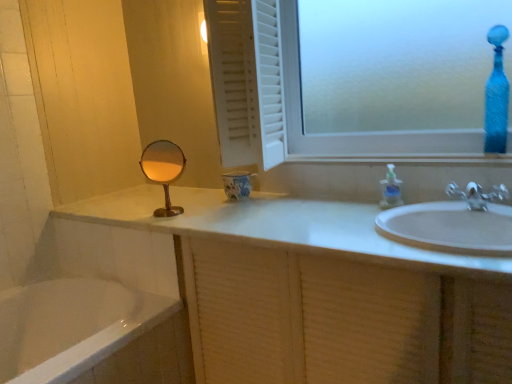
Question: Is blue textured glass vase at upper right further to the viewer compared to silver metallic faucet at right?

Choices:
 (A) no
 (B) yes

Answer: (B)

Question: Is blue textured glass vase at upper right touching silver metallic faucet at right?

Choices:
 (A) yes
 (B) no

Answer: (B)

Question: Considering the relative sizes of blue textured glass vase at upper right and silver metallic faucet at right in the image provided, is blue textured glass vase at upper right smaller than silver metallic faucet at right?

Choices:
 (A) no
 (B) yes

Answer: (A)

Question: Is blue textured glass vase at upper right completely or partially outside of silver metallic faucet at right?

Choices:
 (A) yes
 (B) no

Answer: (A)

Question: Is blue textured glass vase at upper right at the left side of silver metallic faucet at right?

Choices:
 (A) yes
 (B) no

Answer: (B)

Question: Choose the correct answer: Is white textured cabinet at lower right inside gold metallic mirror at center or outside it?

Choices:
 (A) inside
 (B) outside

Answer: (B)

Question: In terms of size, does white textured cabinet at lower right appear bigger or smaller than gold metallic mirror at center?

Choices:
 (A) big
 (B) small

Answer: (A)

Question: Is white textured cabinet at lower right to the left or to the right of gold metallic mirror at center in the image?

Choices:
 (A) left
 (B) right

Answer: (B)

Question: Relative to gold metallic mirror at center, is white textured cabinet at lower right in front or behind?

Choices:
 (A) behind
 (B) front

Answer: (B)

Question: Relative to frosted glass window at upper center, is white glossy sink at upper center in front or behind?

Choices:
 (A) front
 (B) behind

Answer: (B)

Question: Based on their sizes in the image, would you say white glossy sink at upper center is bigger or smaller than frosted glass window at upper center?

Choices:
 (A) big
 (B) small

Answer: (B)

Question: Is white glossy sink at upper center spatially inside frosted glass window at upper center, or outside of it?

Choices:
 (A) outside
 (B) inside

Answer: (B)

Question: Considering the positions of white glossy sink at upper center and frosted glass window at upper center in the image, is white glossy sink at upper center taller or shorter than frosted glass window at upper center?

Choices:
 (A) tall
 (B) short

Answer: (B)

Question: Based on their positions, is gold metallic mirror at center located to the left or right of blue textured glass vase at upper right?

Choices:
 (A) left
 (B) right

Answer: (A)

Question: Is gold metallic mirror at center situated inside blue textured glass vase at upper right or outside?

Choices:
 (A) inside
 (B) outside

Answer: (B)